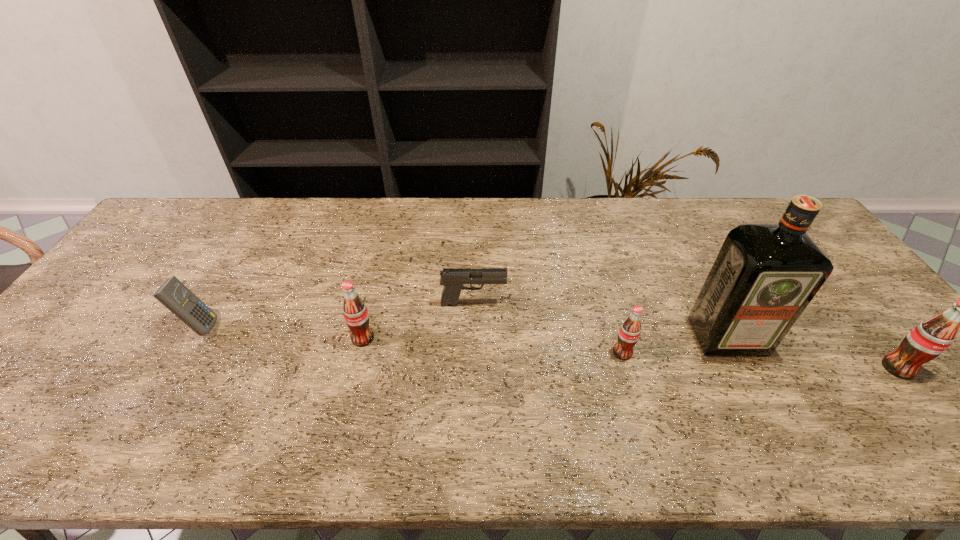
The width and height of the screenshot is (960, 540). I want to click on vacant space situated 0.210m on the left of the second object from left to right, so click(271, 339).

Locate an element on the screen. vacant region located 0.050m on the front of the shortest soda is located at coordinates click(x=630, y=378).

This screenshot has width=960, height=540. In order to click on free location located on the left of the rightmost soda in this screenshot , I will do `click(851, 368)`.

Image resolution: width=960 pixels, height=540 pixels. Find the location of `free space located 0.100m on the front label of the tallest object`. free space located 0.100m on the front label of the tallest object is located at coordinates (756, 393).

The width and height of the screenshot is (960, 540). What are the coordinates of `free region located 0.090m on the front-facing side of the leftmost object` in the screenshot? It's located at pos(252,326).

At what (x,y) coordinates should I click in order to perform the action: click on free point located aim along the barrel of the fourth object from right to left. Please return your answer as a coordinate pair (x, y). Image resolution: width=960 pixels, height=540 pixels. Looking at the image, I should click on (631, 303).

Locate an element on the screen. The height and width of the screenshot is (540, 960). object at the right edge is located at coordinates coord(929,339).

Find the location of a particular element. The height and width of the screenshot is (540, 960). vacant space at the far edge of the desktop is located at coordinates (330, 201).

You are a GUI agent. You are given a task and a screenshot of the screen. Output one action in this format:
    pyautogui.click(x=<x>, y=<y>)
    Task: Click on the free location at the near edge
    
    Given the screenshot: What is the action you would take?
    pyautogui.click(x=774, y=405)

Locate an element on the screen. The height and width of the screenshot is (540, 960). vacant area at the right edge of the desktop is located at coordinates (830, 295).